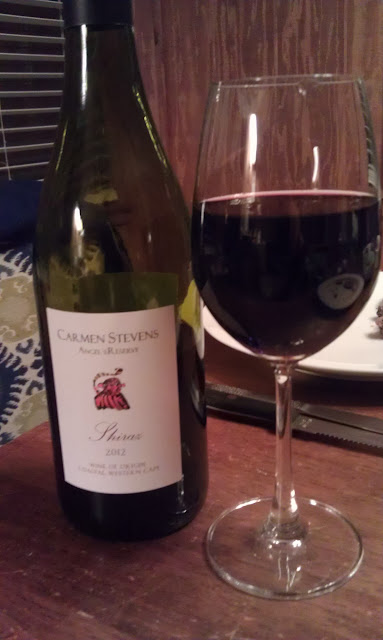
I want to click on cabinet, so click(x=242, y=40).